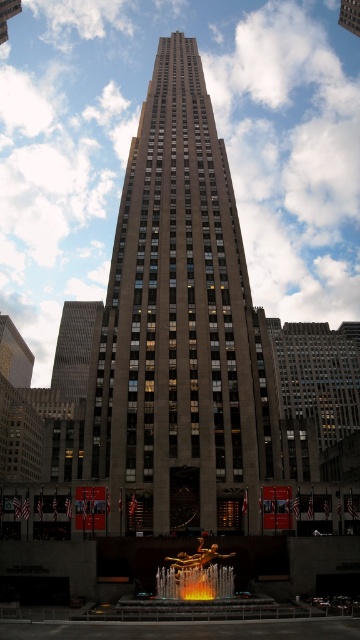
You are standing in front of the Rockefeller Center and see the brown stone tower at center and the dark gray stone tower at left. Which one is positioned higher in the image?

The brown stone tower at center is located above the dark gray stone tower at left, so it is positioned higher in the image.

You are standing in front of the Rockefeller Center skyscraper and want to take a photo that includes both the golden Prometheus and Pandora statues and the building itself. The statues are located at point (243,419) and the building entrance is at point (69,401). Which point should you stand closer to ensure both are in frame?

You should stand closer to point (243,419) because it is closer to the viewer than point (69,401), allowing both the statues and the building entrance to be captured in the photo.

You are a construction worker needing to transport a 55 meter long beam between the brown stone tower at center and the dark gray stone tower at left. Can the beam fit between them?

The brown stone tower at center is 56.18 meters away from the dark gray stone tower at left, so the 55 meter long beam can fit between them since the distance is slightly longer than the beam.